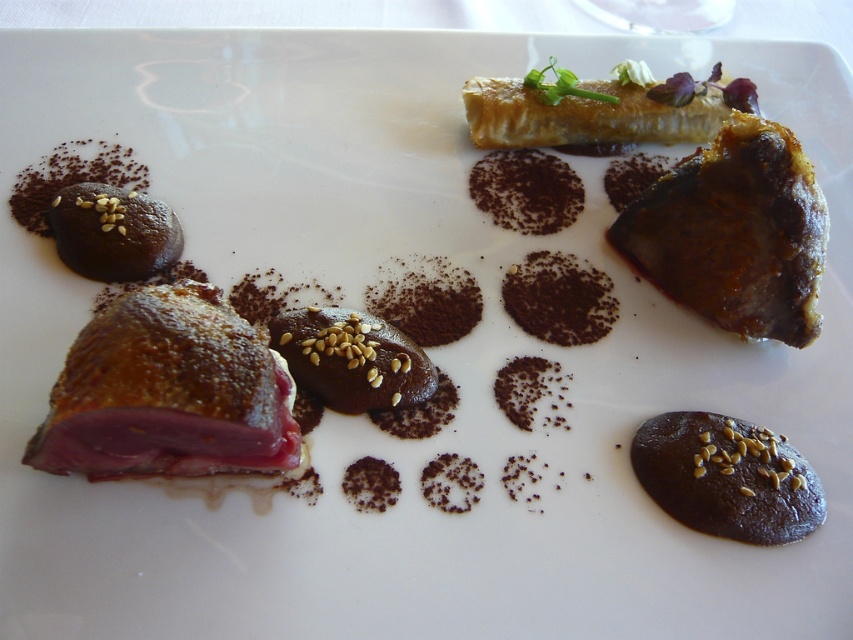
Question: Does brown crispy duck at lower left have a larger size compared to brown chocolate with seeds at center?

Choices:
 (A) yes
 (B) no

Answer: (A)

Question: Does brown chocolate with seeds at center have a lesser width compared to semi-glossy chocolate cookie at lower left?

Choices:
 (A) yes
 (B) no

Answer: (B)

Question: Considering the real-world distances, which object is closest to the savory brown crumbly pastry at upper right?

Choices:
 (A) semi-glossy chocolate cookie at lower left
 (B) dark chocolate cookie at center
 (C) golden brown flaky pastry at upper right
 (D) brown crispy duck at lower left

Answer: (C)

Question: Which object is the closest to the dark chocolate cookie at center?

Choices:
 (A) brown crispy duck at lower left
 (B) savory brown crumbly pastry at upper right
 (C) semi-glossy chocolate cookie at lower left

Answer: (B)

Question: Which object is positioned farthest from the savory brown crumbly pastry at upper right?

Choices:
 (A) brown chocolate with seeds at center
 (B) brown crispy duck at lower left
 (C) dark chocolate cookie at center

Answer: (B)

Question: Is brown crispy duck at lower left bigger than brown chocolate with seeds at center?

Choices:
 (A) yes
 (B) no

Answer: (A)